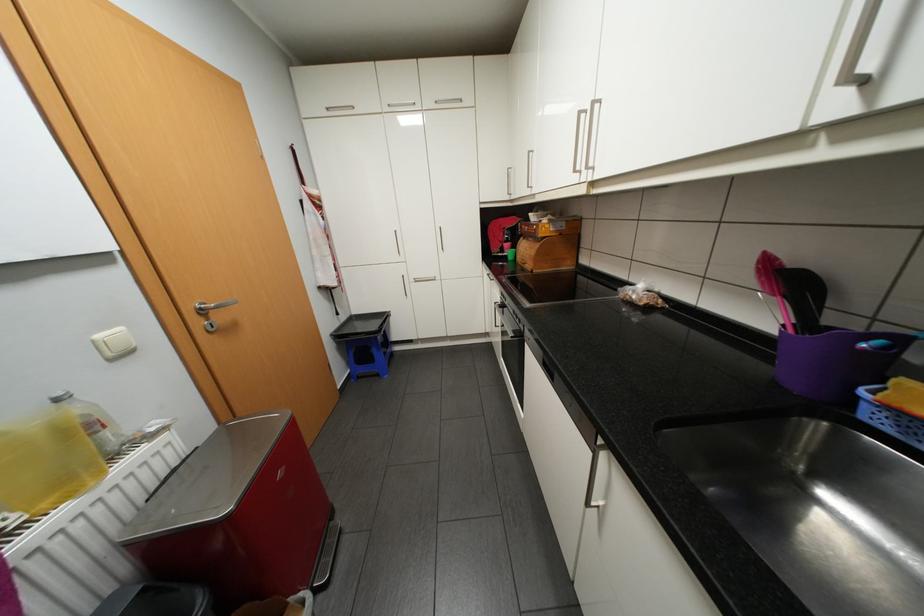
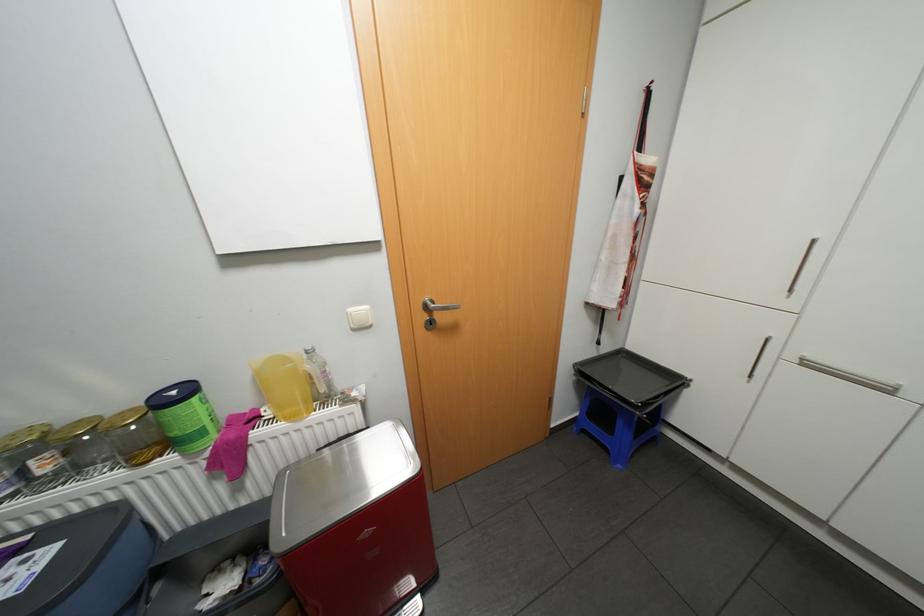
Where in the second image is the point corresponding to [367,377] from the first image?

(591, 431)